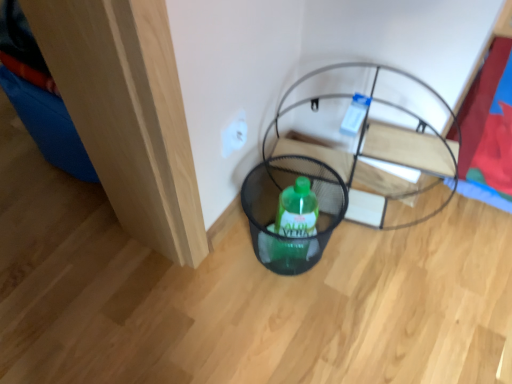
Question: Is there a large distance between black mesh basket at lower center and black mesh basket at center?

Choices:
 (A) no
 (B) yes

Answer: (A)

Question: From the image's perspective, does black mesh basket at lower center appear lower than black mesh basket at center?

Choices:
 (A) no
 (B) yes

Answer: (B)

Question: From the image's perspective, is black mesh basket at lower center above black mesh basket at center?

Choices:
 (A) yes
 (B) no

Answer: (B)

Question: Would you say black mesh basket at center is part of black mesh basket at lower center's contents?

Choices:
 (A) no
 (B) yes

Answer: (A)

Question: Does black mesh basket at lower center touch black mesh basket at center?

Choices:
 (A) yes
 (B) no

Answer: (B)

Question: Considering the positions of white plastic electric outlet at center and black mesh basket at center in the image, is white plastic electric outlet at center taller or shorter than black mesh basket at center?

Choices:
 (A) tall
 (B) short

Answer: (B)

Question: Is white plastic electric outlet at center to the left or to the right of black mesh basket at center in the image?

Choices:
 (A) right
 (B) left

Answer: (B)

Question: In terms of size, does white plastic electric outlet at center appear bigger or smaller than black mesh basket at center?

Choices:
 (A) big
 (B) small

Answer: (B)

Question: Looking at their shapes, would you say white plastic electric outlet at center is wider or thinner than black mesh basket at center?

Choices:
 (A) thin
 (B) wide

Answer: (A)

Question: Is black mesh basket at lower center in front of or behind white plastic electric outlet at center in the image?

Choices:
 (A) behind
 (B) front

Answer: (B)

Question: From the image's perspective, is black mesh basket at lower center above or below white plastic electric outlet at center?

Choices:
 (A) above
 (B) below

Answer: (B)

Question: Based on their positions, is black mesh basket at lower center located to the left or right of white plastic electric outlet at center?

Choices:
 (A) right
 (B) left

Answer: (A)

Question: Does point (292, 258) appear closer or farther from the camera than point (229, 147)?

Choices:
 (A) closer
 (B) farther

Answer: (B)

Question: Does point (397, 109) appear closer or farther from the camera than point (229, 134)?

Choices:
 (A) farther
 (B) closer

Answer: (A)

Question: Considering the positions of black mesh basket at center and white plastic electric outlet at center in the image, is black mesh basket at center wider or thinner than white plastic electric outlet at center?

Choices:
 (A) wide
 (B) thin

Answer: (A)